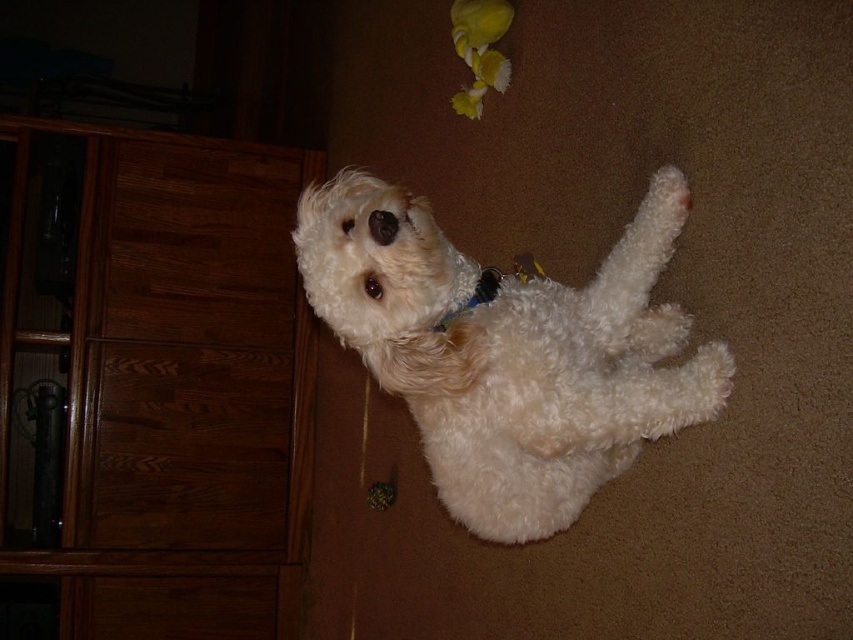
You are standing in the room and see two points marked in the image. Which point is closer to you, point [206,188] or point [543,406]?

Point [543,406] is closer to you because point [206,188] is behind it.

You are trying to decide whether to place a new rectangular pet bed in the space between the brown wood dresser at left and the white fluffy dog at center. The pet bed is 1.2 meters long. Can the pet bed fit horizontally between these two objects?

The brown wood dresser at left is wider than the white fluffy dog at center. However, without knowing the exact distance between them, we cannot determine if the pet bed will fit. Please measure the space between the two objects first.